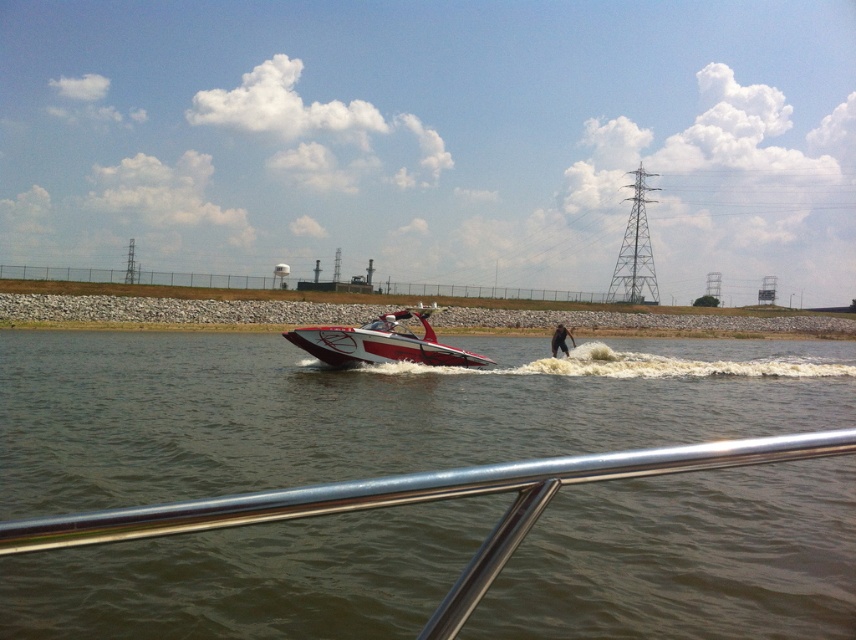
You are standing on the metallic railing in the foreground. You want to locate the shiny red and white speedboat at center. Can you tell me its 2D coordinates in the image?

The 2D coordinates of the shiny red and white speedboat at center are at point (383, 342).

You are standing on the metallic railing in the foreground of the image. You see two points marked in the scene. Which point is closer to you, point [239,381] or point [569,332]?

Point [239,381] is closer to the viewer than point [569,332].

You are standing on the dock and looking at two points on the water. The first point is at coordinates point [407,332] and the second point is at point [574,342]. Which point is closer to you?

Point [407,332] is closer to the viewer than point [574,342].